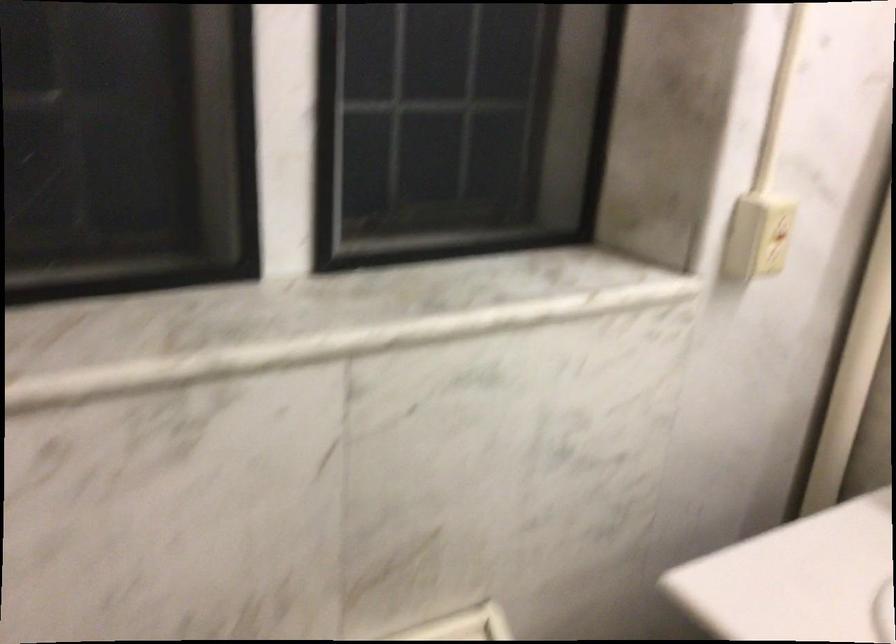
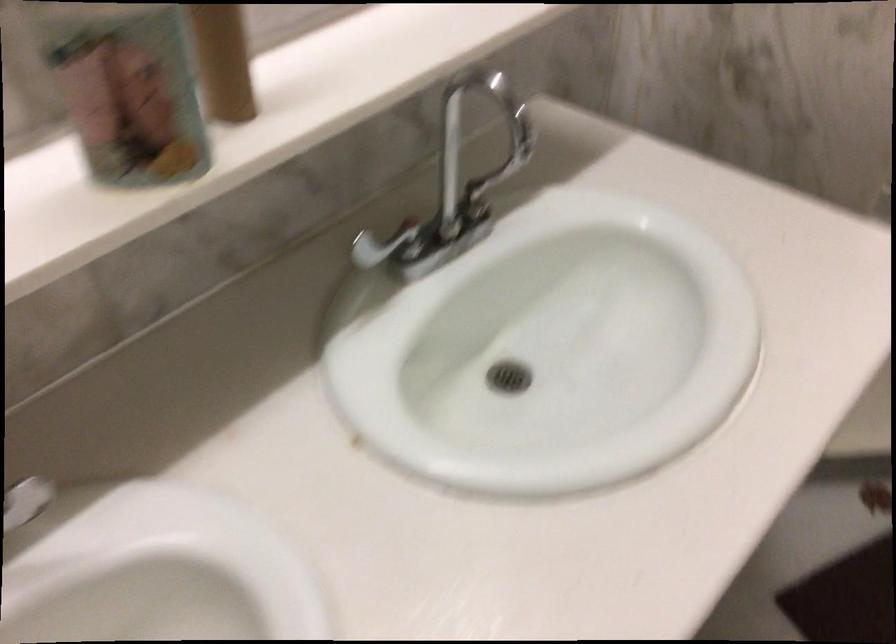
First-person continuous shooting, in which direction is the camera rotating?

The rotation direction of the camera is right-down.